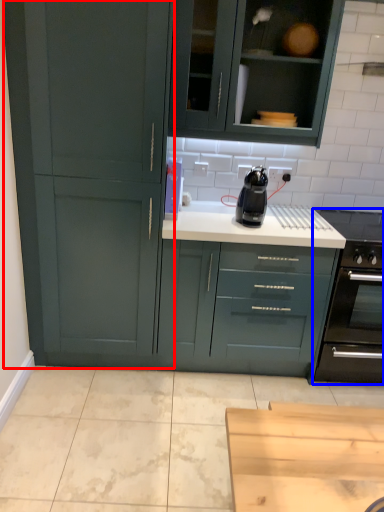
Question: Which point is further to the camera, cupboard (highlighted by a red box) or home appliance (highlighted by a blue box)?

Choices:
 (A) cupboard
 (B) home appliance

Answer: (B)